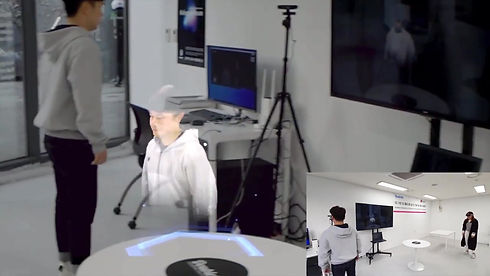
Locate an element on the screen. This screenshot has width=490, height=276. laptop is located at coordinates pos(379,236).